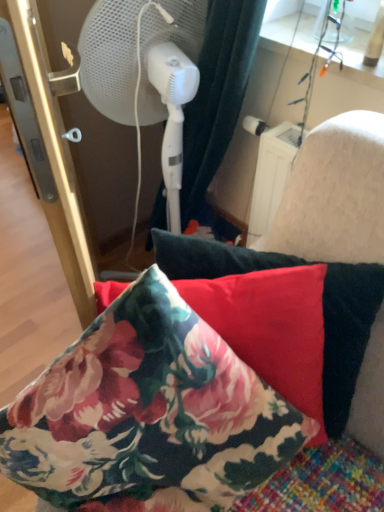
In order to face floral fabric pillow at center, should I rotate leftwards or rightwards?

To align with it, rotate right about 7.400°.

Describe the element at coordinates (318, 305) in the screenshot. This screenshot has height=512, width=384. I see `floral fabric pillow at center` at that location.

Where is `floral fabric pillow at center`? floral fabric pillow at center is located at coordinates (318, 305).

Measure the distance between floral fabric pillow at center and camera.

A distance of 67.20 centimeters exists between floral fabric pillow at center and camera.

Consider the image. Measure the distance between point [82,79] and camera.

1.13 meters.

This screenshot has height=512, width=384. Describe the element at coordinates (144, 74) in the screenshot. I see `white plastic mechanical fan at left` at that location.

In order to click on white plastic mechanical fan at left in this screenshot , I will do `click(144, 74)`.

Identify the location of floral fabric pillow at center. This screenshot has width=384, height=512. (318, 305).

Considering the positions of objects white plastic mechanical fan at left and floral fabric pillow at center in the image provided, who is more to the right, white plastic mechanical fan at left or floral fabric pillow at center?

From the viewer's perspective, floral fabric pillow at center appears more on the right side.

Is white plastic mechanical fan at left closer to the viewer compared to floral fabric pillow at center?

No, it is not.

Is point (121, 58) closer to camera compared to point (213, 275)?

No.

From the image's perspective, which one is positioned higher, white plastic mechanical fan at left or floral fabric pillow at center?

From the image's view, white plastic mechanical fan at left is above.

From a real-world perspective, is white plastic mechanical fan at left located beneath floral fabric pillow at center?

No.

Based on the photo, between white plastic mechanical fan at left and floral fabric pillow at center, which one has larger width?

Wider between the two is white plastic mechanical fan at left.

Between white plastic mechanical fan at left and floral fabric pillow at center, which one has less height?

floral fabric pillow at center is shorter.

Can you confirm if white plastic mechanical fan at left is bigger than floral fabric pillow at center?

Actually, white plastic mechanical fan at left might be smaller than floral fabric pillow at center.

Is floral fabric pillow at center inside white plastic mechanical fan at left?

No, floral fabric pillow at center is not a part of white plastic mechanical fan at left.

Is there a large distance between white plastic mechanical fan at left and floral fabric pillow at center?

No, white plastic mechanical fan at left is not far away from floral fabric pillow at center.

Does white plastic mechanical fan at left turn towards floral fabric pillow at center?

No, white plastic mechanical fan at left is not facing towards floral fabric pillow at center.

You are a GUI agent. You are given a task and a screenshot of the screen. Output one action in this format:
    pyautogui.click(x=<x>, y=<y>)
    Task: Click on the pillow on the right of white plastic mechanical fan at left
    The image size is (384, 512).
    Given the screenshot: What is the action you would take?
    pyautogui.click(x=318, y=305)

In the scene shown: Can you confirm if floral fabric pillow at center is positioned to the right of white plastic mechanical fan at left?

Yes.

Is floral fabric pillow at center further to camera compared to white plastic mechanical fan at left?

No.

Does point (297, 265) come behind point (94, 26)?

No, it is in front of (94, 26).

From the image's perspective, which object appears higher, floral fabric pillow at center or white plastic mechanical fan at left?

From the image's view, white plastic mechanical fan at left is above.

From a real-world perspective, relative to white plastic mechanical fan at left, is floral fabric pillow at center vertically above or below?

From a real-world perspective, floral fabric pillow at center is physically below white plastic mechanical fan at left.

Based on the photo, considering the relative sizes of floral fabric pillow at center and white plastic mechanical fan at left in the image provided, is floral fabric pillow at center thinner than white plastic mechanical fan at left?

Correct, the width of floral fabric pillow at center is less than that of white plastic mechanical fan at left.

In terms of height, does floral fabric pillow at center look taller or shorter compared to white plastic mechanical fan at left?

Considering their sizes, floral fabric pillow at center has less height than white plastic mechanical fan at left.

Can you confirm if floral fabric pillow at center is smaller than white plastic mechanical fan at left?

Incorrect, floral fabric pillow at center is not smaller in size than white plastic mechanical fan at left.

From the picture: Is floral fabric pillow at center located outside white plastic mechanical fan at left?

Yes.

Is floral fabric pillow at center in contact with white plastic mechanical fan at left?

No, floral fabric pillow at center is not in contact with white plastic mechanical fan at left.

Is floral fabric pillow at center turned away from white plastic mechanical fan at left?

That's right, floral fabric pillow at center is facing away from white plastic mechanical fan at left.

Can you tell me how much floral fabric pillow at center and white plastic mechanical fan at left differ in facing direction?

135 degrees.

This screenshot has width=384, height=512. I want to click on mechanical fan on the left of floral fabric pillow at center, so click(x=144, y=74).

Identify the location of pillow in front of the white plastic mechanical fan at left. The width and height of the screenshot is (384, 512). (318, 305).

The image size is (384, 512). Find the location of `mechanical fan that appears above the floral fabric pillow at center (from the image's perspective)`. mechanical fan that appears above the floral fabric pillow at center (from the image's perspective) is located at coordinates (144, 74).